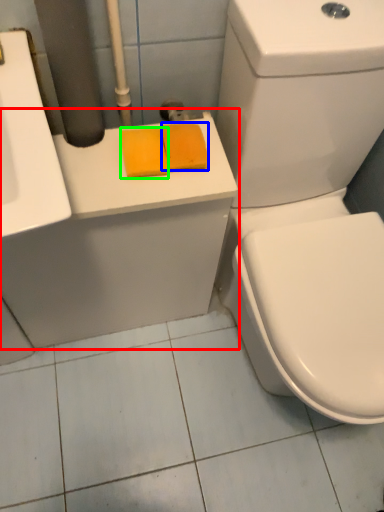
Question: Which object is positioned farthest from counter top (highlighted by a red box)? Select from soap (highlighted by a blue box) and soap (highlighted by a green box).

Choices:
 (A) soap
 (B) soap

Answer: (A)